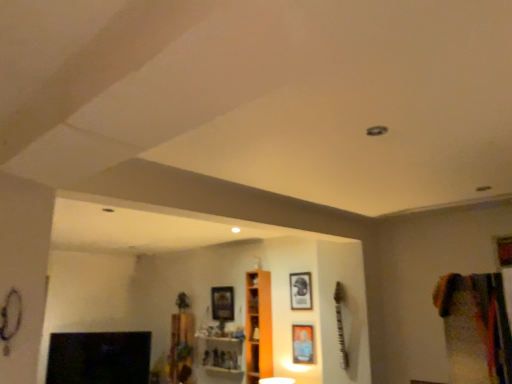
Question: Is metallic silver picture frame at center, which appears as the 1th picture frame when viewed from the front, further to camera compared to matte black picture frame at center, the 2th picture frame positioned from the front?

Choices:
 (A) yes
 (B) no

Answer: (B)

Question: Is metallic silver picture frame at center, which is the second picture frame in left-to-right order, next to matte black picture frame at center, the first picture frame from the right?

Choices:
 (A) no
 (B) yes

Answer: (A)

Question: From a real-world perspective, is metallic silver picture frame at center, positioned as the second picture frame in right-to-left order, physically below matte black picture frame at center, acting as the second picture frame starting from the back?

Choices:
 (A) yes
 (B) no

Answer: (A)

Question: From a real-world perspective, is metallic silver picture frame at center, the third picture frame viewed from the back, located higher than matte black picture frame at center, the 2th picture frame positioned from the front?

Choices:
 (A) no
 (B) yes

Answer: (A)

Question: Is metallic silver picture frame at center, which is the second picture frame in left-to-right order, located outside matte black picture frame at center, acting as the second picture frame starting from the back?

Choices:
 (A) yes
 (B) no

Answer: (A)

Question: Is metallic silver picture frame at center, which is the second picture frame in left-to-right order, taller than matte black picture frame at center, the first picture frame from the right?

Choices:
 (A) yes
 (B) no

Answer: (B)

Question: Is the position of multicolored fabric at right more distant than that of matte black picture frame at center, the 2th picture frame positioned from the front?

Choices:
 (A) yes
 (B) no

Answer: (B)

Question: Is multicolored fabric at right to the left of matte black picture frame at center, the first picture frame from the right, from the viewer's perspective?

Choices:
 (A) no
 (B) yes

Answer: (A)

Question: Does multicolored fabric at right have a smaller size compared to matte black picture frame at center, the first picture frame from the right?

Choices:
 (A) yes
 (B) no

Answer: (B)

Question: Considering the relative sizes of multicolored fabric at right and matte black picture frame at center, the first picture frame from the right, in the image provided, is multicolored fabric at right bigger than matte black picture frame at center, the first picture frame from the right,?

Choices:
 (A) no
 (B) yes

Answer: (B)

Question: Considering the relative sizes of multicolored fabric at right and matte black picture frame at center, the 2th picture frame positioned from the front, in the image provided, is multicolored fabric at right shorter than matte black picture frame at center, the 2th picture frame positioned from the front,?

Choices:
 (A) no
 (B) yes

Answer: (A)

Question: Is multicolored fabric at right taller than matte black picture frame at center, which is the third picture frame from left to right?

Choices:
 (A) no
 (B) yes

Answer: (B)

Question: Is matte black picture frame at center, acting as the second picture frame starting from the back, outside orange wood cabinet at center?

Choices:
 (A) no
 (B) yes

Answer: (B)